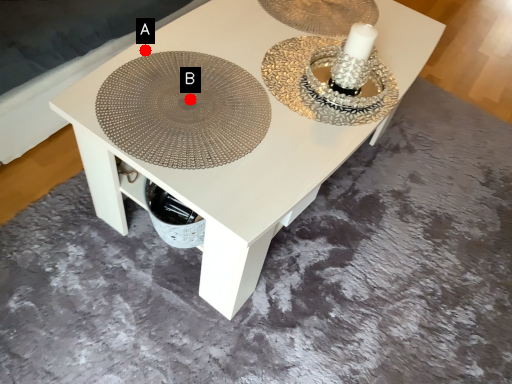
Question: Two points are circled on the image, labeled by A and B beside each circle. Which point is closer to the camera?

Choices:
 (A) A is closer
 (B) B is closer

Answer: (B)